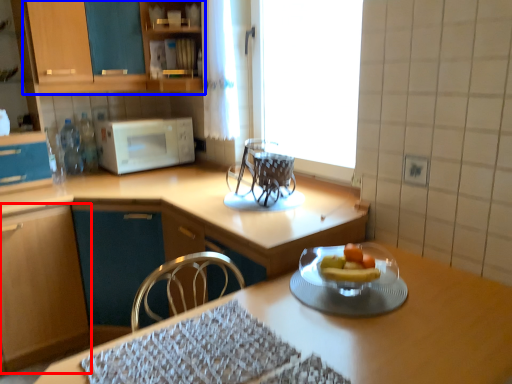
Question: Which object appears farthest to the camera in this image, cabinetry (highlighted by a red box) or cabinetry (highlighted by a blue box)?

Choices:
 (A) cabinetry
 (B) cabinetry

Answer: (B)